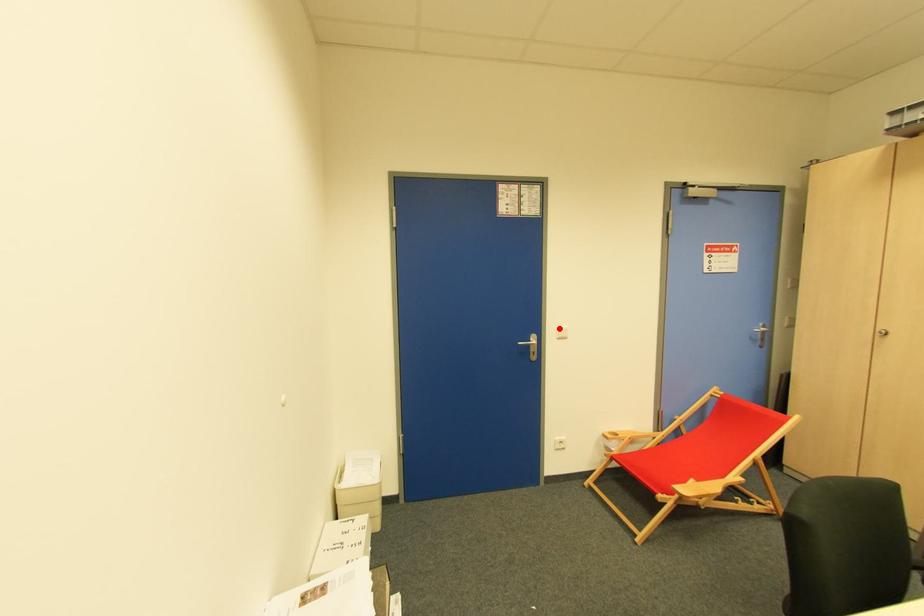
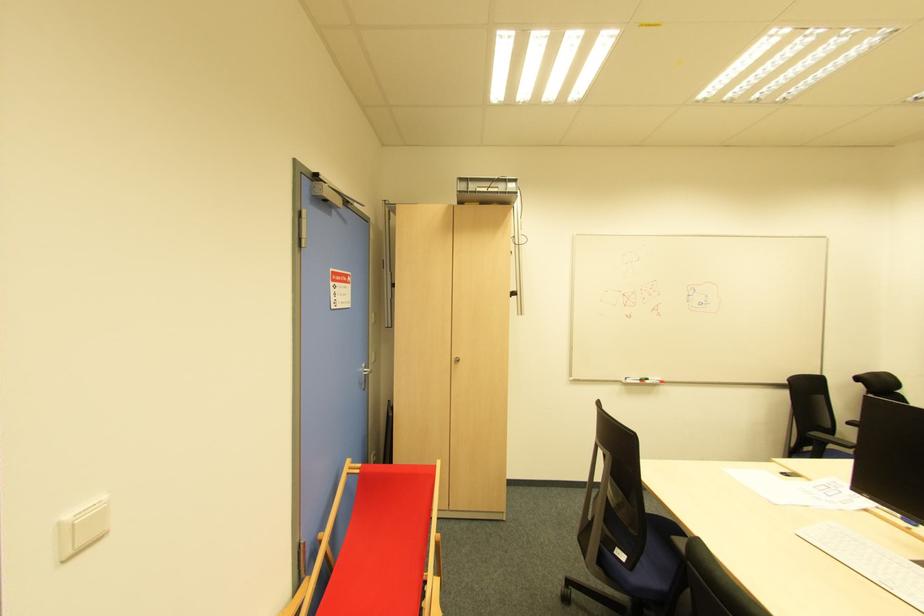
The point at the highlighted location is marked in the first image. Where is the corresponding point in the second image?

(69, 517)